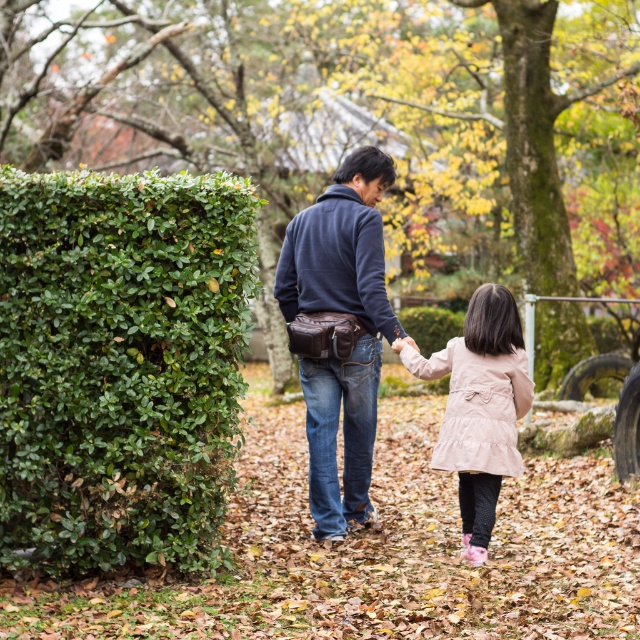
Can you confirm if navy blue sweater at center is smaller than pale pink suede coat at center?

Incorrect, navy blue sweater at center is not smaller in size than pale pink suede coat at center.

Which of these two, navy blue sweater at center or pale pink suede coat at center, stands taller?

navy blue sweater at center

Find the location of a particular element. navy blue sweater at center is located at coordinates (340, 330).

This screenshot has height=640, width=640. Find the location of `navy blue sweater at center`. navy blue sweater at center is located at coordinates (x=340, y=330).

In the scene shown: Does green leafy hedge at left lie in front of navy blue sweater at center?

Yes, it is.

Is green leafy hedge at left bigger than navy blue sweater at center?

No, green leafy hedge at left is not bigger than navy blue sweater at center.

Does point (70, 301) lie behind point (362, 493)?

No, (70, 301) is in front of (362, 493).

Identify the location of green leafy hedge at left. (120, 364).

Does green leafy hedge at left have a greater height compared to pale pink suede coat at center?

Correct, green leafy hedge at left is much taller as pale pink suede coat at center.

Consider the image. Is green leafy hedge at left closer to camera compared to pale pink suede coat at center?

Yes, green leafy hedge at left is closer to the viewer.

At what (x,y) coordinates should I click in order to perform the action: click on green leafy hedge at left. Please return your answer as a coordinate pair (x, y). The width and height of the screenshot is (640, 640). Looking at the image, I should click on (120, 364).